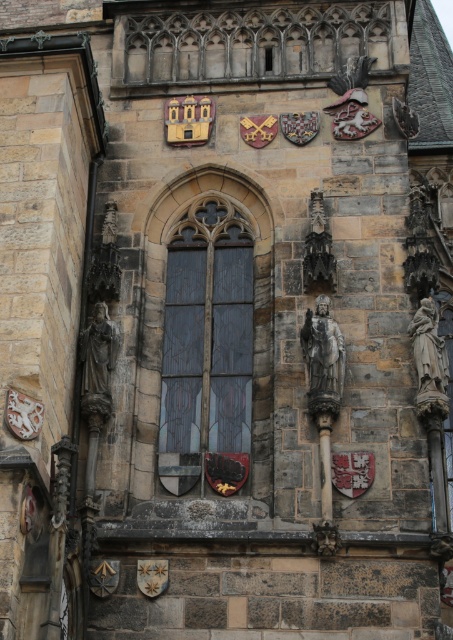
You are an architect assessing the structural integrity of the building. You need to determine if the stained glass window at center can support a decorative stone statue at left placed directly to its right. Based on their widths, is this placement feasible?

The stained glass window at center might be wider than stone statue at left, so placing the statue directly to its right may be possible if the window provides sufficient structural support. However, further analysis of the window frame and load capacity is needed to confirm feasibility.

You are an art student standing in front of the historic stone building. You notice the polished stone statue at center and the stone statue at right. Which statue is closer to you?

The polished stone statue at center is closer to you than the stone statue at right.